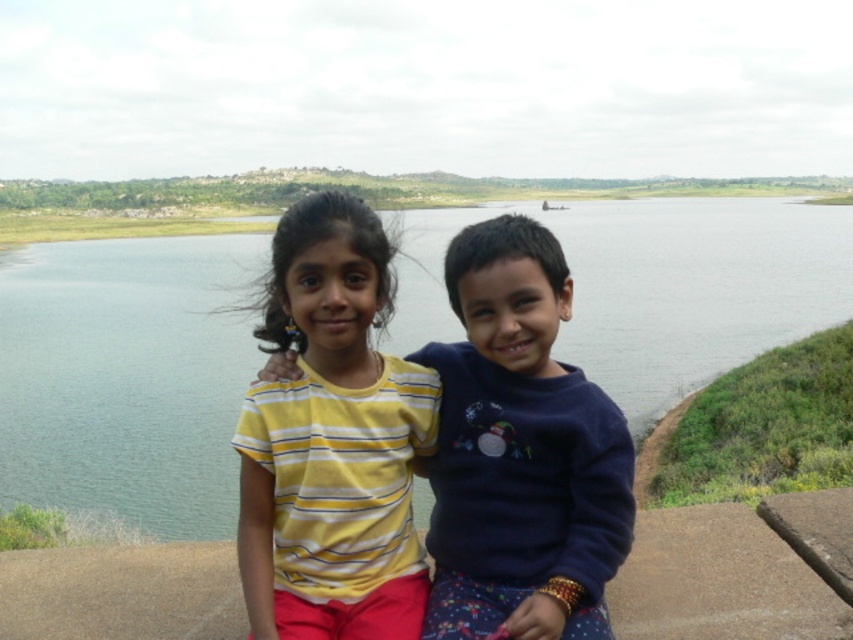
Between blue water at center and yellow striped shirt at center, which one has less height?

With less height is yellow striped shirt at center.

Who is more forward, (x=155, y=317) or (x=318, y=266)?

Point (x=318, y=266) is in front.

Is point (94, 348) positioned after point (277, 244)?

Yes, point (94, 348) is farther from viewer.

Locate an element on the screen. The height and width of the screenshot is (640, 853). blue water at center is located at coordinates (126, 380).

How far apart are blue water at center and dark blue sweater at center?

blue water at center and dark blue sweater at center are 76.98 meters apart from each other.

Who is more forward, (144, 333) or (467, 340)?

Positioned in front is point (467, 340).

I want to click on blue water at center, so click(126, 380).

Identify the location of blue water at center. (126, 380).

Does yellow striped shirt at center appear on the right side of dark blue sweater at center?

In fact, yellow striped shirt at center is to the left of dark blue sweater at center.

Between yellow striped shirt at center and dark blue sweater at center, which one is positioned lower?

dark blue sweater at center

Is point (332, 396) positioned after point (564, 522)?

Yes, it is behind point (564, 522).

Where is `yellow striped shirt at center`? yellow striped shirt at center is located at coordinates (332, 442).